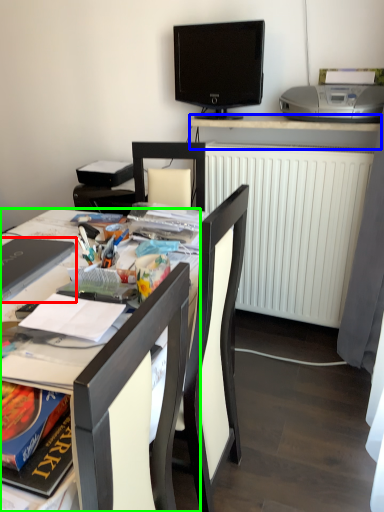
Question: Which is farther away from laptop (highlighted by a red box)? desk (highlighted by a blue box) or desk (highlighted by a green box)?

Choices:
 (A) desk
 (B) desk

Answer: (A)